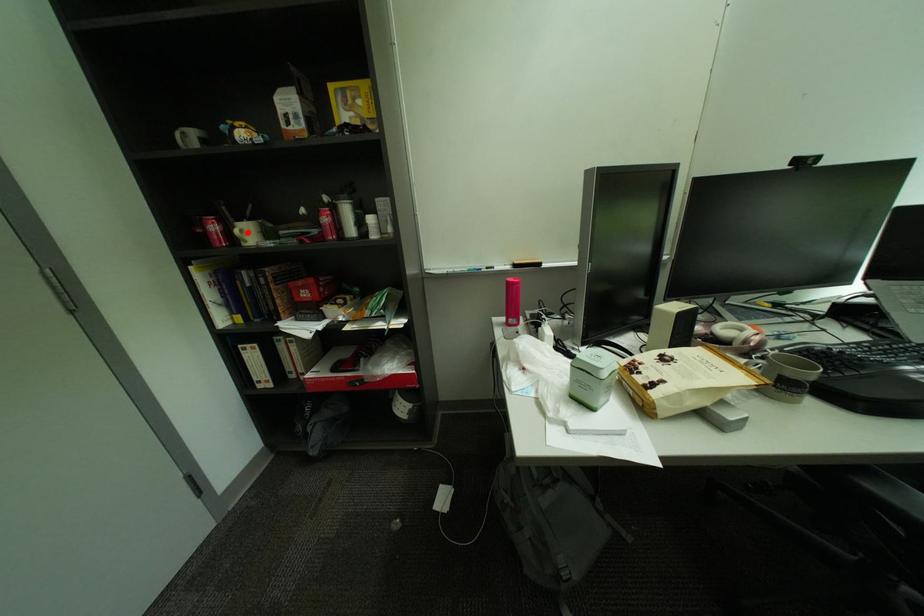
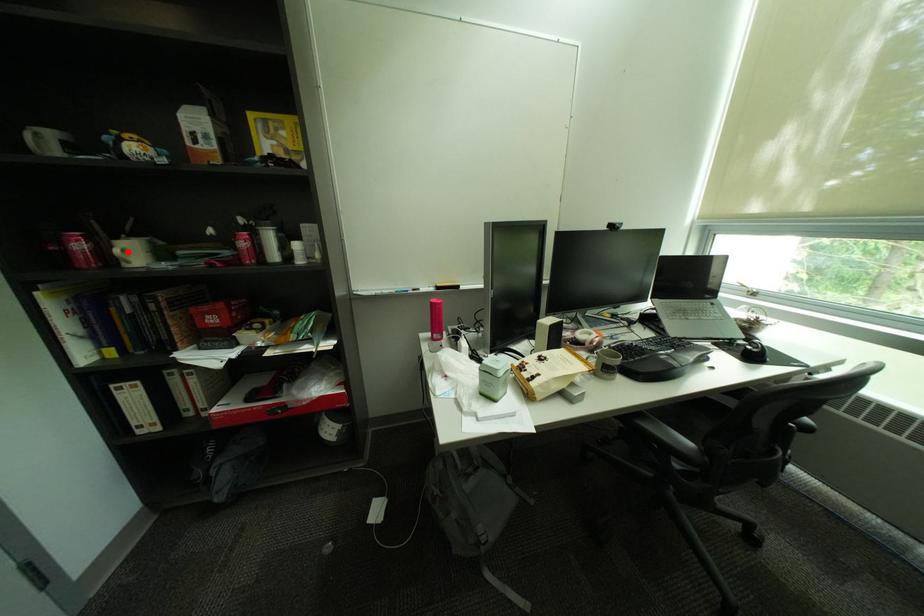
I am providing you with two images of the same scene from different viewpoints. A red point is marked on the first image and another point is marked on the second image. Is the marked point in image1 the same physical position as the marked point in image2?

Yes